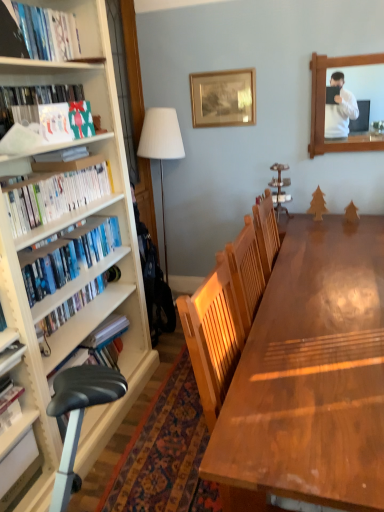
Find the location of a particular element. This screenshot has height=512, width=384. white glossy bookshelf at left, the third book ordered from the bottom is located at coordinates (55, 196).

In order to click on wooden frame at upper right in this screenshot , I will do `click(324, 106)`.

Image resolution: width=384 pixels, height=512 pixels. Describe the element at coordinates (324, 106) in the screenshot. I see `wooden frame at upper right` at that location.

Describe the element at coordinates (21, 475) in the screenshot. I see `hardcover book at left, which is counted as the 1th book, starting from the bottom` at that location.

Locate an element on the screen. hardcover book at left, which is counted as the 1th book, starting from the bottom is located at coordinates (21, 475).

The height and width of the screenshot is (512, 384). Describe the element at coordinates (310, 377) in the screenshot. I see `shiny brown wooden table at center` at that location.

What do you see at coordinates (223, 98) in the screenshot?
I see `wooden picture frame at upper center` at bounding box center [223, 98].

Identify the location of hardcover book at upper left, marked as the first book in a top-to-bottom arrangement. The image size is (384, 512). (48, 33).

How much space does hardcover book at upper left, marked as the first book in a top-to-bottom arrangement, occupy horizontally?

It is 1.96 inches.

The image size is (384, 512). I want to click on matte green gift bag at left, which ranks as the fourth book in bottom-to-top order, so click(x=33, y=102).

Consider the image. Is shiny brown wooden table at center not near hardcover book at left, which is counted as the 1th book, starting from the bottom?

Yes, shiny brown wooden table at center and hardcover book at left, which is counted as the 1th book, starting from the bottom, are quite far apart.

In the image, there is a shiny brown wooden table at center. Where is `book below it (from a real-world perspective)`? book below it (from a real-world perspective) is located at coordinates pyautogui.click(x=21, y=475).

Is shiny brown wooden table at center not within hardcover book at left, which is counted as the 1th book, starting from the bottom?

shiny brown wooden table at center lies outside hardcover book at left, which is counted as the 1th book, starting from the bottom,'s area.

From a real-world perspective, is wooden frame at upper right positioned over shiny brown wooden table at center based on gravity?

Yes, from a real-world perspective, wooden frame at upper right is above shiny brown wooden table at center.

Considering the relative sizes of wooden frame at upper right and shiny brown wooden table at center in the image provided, is wooden frame at upper right shorter than shiny brown wooden table at center?

Indeed, wooden frame at upper right has a lesser height compared to shiny brown wooden table at center.

Which object is positioned more to the left, wooden frame at upper right or shiny brown wooden table at center?

Positioned to the left is shiny brown wooden table at center.

From a real-world perspective, is white glossy bookshelf at left, the third book ordered from the bottom, positioned above or below wooden frame at upper right?

In terms of real-world spatial position, white glossy bookshelf at left, the third book ordered from the bottom, is below wooden frame at upper right.

Visually, is white glossy bookshelf at left, the third book ordered from the bottom, positioned to the left or to the right of wooden frame at upper right?

From the image, it's evident that white glossy bookshelf at left, the third book ordered from the bottom, is to the left of wooden frame at upper right.

Between white glossy bookshelf at left, the 3th book positioned from the top, and wooden frame at upper right, which one has smaller width?

Thinner between the two is wooden frame at upper right.

Find the location of `the 5th book counting from the left side of the wooden picture frame at upper center`. the 5th book counting from the left side of the wooden picture frame at upper center is located at coordinates (21, 475).

From the image's perspective, is wooden picture frame at upper center positioned above or below hardcover book at left, which is counted as the 1th book, starting from the bottom?

wooden picture frame at upper center is above hardcover book at left, which is counted as the 1th book, starting from the bottom.

Are wooden picture frame at upper center and hardcover book at left, which is the fifth book from top to bottom, located far from each other?

Yes, wooden picture frame at upper center is far from hardcover book at left, which is the fifth book from top to bottom.

Is wooden picture frame at upper center facing towards hardcover book at left, which is counted as the 1th book, starting from the bottom?

No, wooden picture frame at upper center does not turn towards hardcover book at left, which is counted as the 1th book, starting from the bottom.

Is white glossy bookshelf at left, the third book ordered from the bottom, wider than shiny brown wooden table at center?

No.

This screenshot has height=512, width=384. In the image, there is a white glossy bookshelf at left, the 3th book positioned from the top. In order to click on desk below it (from the image's perspective) in this screenshot , I will do `click(310, 377)`.

Which is in front, white glossy bookshelf at left, the 3th book positioned from the top, or shiny brown wooden table at center?

shiny brown wooden table at center is more forward.

Which of these two, white glossy bookshelf at left, the 3th book positioned from the top, or shiny brown wooden table at center, stands taller?

With more height is shiny brown wooden table at center.

Does hardcover book at upper left, marked as the first book in a top-to-bottom arrangement, have a greater height compared to wooden frame at upper right?

In fact, hardcover book at upper left, marked as the first book in a top-to-bottom arrangement, may be shorter than wooden frame at upper right.

Based on the photo, can you confirm if hardcover book at upper left, the 5th book positioned from the bottom, is positioned to the right of wooden frame at upper right?

No, hardcover book at upper left, the 5th book positioned from the bottom, is not to the right of wooden frame at upper right.

Is point (73, 57) farther from camera compared to point (324, 150)?

That is False.

Is hardcover book at upper left, marked as the first book in a top-to-bottom arrangement, further to the viewer compared to wooden frame at upper right?

No.

Could wooden frame at upper right be considered to be inside matte green gift bag at left, which ranks as the fourth book in bottom-to-top order?

That's incorrect, wooden frame at upper right is not inside matte green gift bag at left, which ranks as the fourth book in bottom-to-top order.

In terms of width, does matte green gift bag at left, the second book in the top-to-bottom sequence, look wider or thinner when compared to wooden frame at upper right?

Considering their sizes, matte green gift bag at left, the second book in the top-to-bottom sequence, looks broader than wooden frame at upper right.

Identify the location of the 4th book to the left of the wooden frame at upper right, counting from the anchor's position. The image size is (384, 512). (33, 102).

This screenshot has width=384, height=512. I want to click on desk above the hardcover book at left, which is counted as the 1th book, starting from the bottom (from a real-world perspective), so click(310, 377).

Identify the location of desk below the wooden frame at upper right (from a real-world perspective). Image resolution: width=384 pixels, height=512 pixels. (310, 377).

Considering their positions, is matte green gift bag at left, which ranks as the fourth book in bottom-to-top order, positioned further to white glossy bookshelf at left, the third book ordered from the bottom, than shiny brown wooden table at center?

shiny brown wooden table at center lies further to white glossy bookshelf at left, the third book ordered from the bottom, than the other object.

Considering their positions, is wooden frame at upper right positioned further to wooden picture frame at upper center than matte green gift bag at left, which ranks as the fourth book in bottom-to-top order?

Based on the image, matte green gift bag at left, which ranks as the fourth book in bottom-to-top order, appears to be further to wooden picture frame at upper center.

When comparing their distances from hardcover book at upper left, the 5th book positioned from the bottom, does matte green gift bag at left, the second book in the top-to-bottom sequence, or shiny brown wooden table at center seem further?

shiny brown wooden table at center lies further to hardcover book at upper left, the 5th book positioned from the bottom, than the other object.

From the image, which object appears to be farther from blue matte bookshelf at left, arranged as the second book when ordered from the bottom, wooden frame at upper right or hardcover book at left, which is the fifth book from top to bottom?

wooden frame at upper right lies further to blue matte bookshelf at left, arranged as the second book when ordered from the bottom, than the other object.

When comparing their distances from wooden frame at upper right, does matte green gift bag at left, which ranks as the fourth book in bottom-to-top order, or white glossy bookshelf at left, the third book ordered from the bottom, seem closer?

white glossy bookshelf at left, the third book ordered from the bottom, is positioned closer to the anchor wooden frame at upper right.

Looking at the image, which one is located further to wooden frame at upper right, white glossy bookshelf at left, the 3th book positioned from the top, or blue matte bookshelf at left, arranged as the second book when ordered from the bottom?

blue matte bookshelf at left, arranged as the second book when ordered from the bottom, is further to wooden frame at upper right.

Estimate the real-world distances between objects in this image. Which object is closer to white fabric lampshade at left, blue matte bookshelf at left, arranged as the second book when ordered from the bottom, or hardcover book at left, which is counted as the 1th book, starting from the bottom?

blue matte bookshelf at left, arranged as the second book when ordered from the bottom, is closer to white fabric lampshade at left.

Considering their positions, is white fabric lampshade at left positioned closer to hardcover book at upper left, the 5th book positioned from the bottom, than hardcover book at left, which is the fifth book from top to bottom?

white fabric lampshade at left.

The height and width of the screenshot is (512, 384). What are the coordinates of `mirror positioned between shiny brown wooden table at center and wooden picture frame at upper center from near to far` in the screenshot? It's located at (324, 106).

At what (x,y) coordinates should I click in order to perform the action: click on mirror between shiny brown wooden table at center and white fabric lampshade at left along the z-axis. Please return your answer as a coordinate pair (x, y). Looking at the image, I should click on (324, 106).

Find the location of `lamp positioned between shiny brown wooden table at center and wooden picture frame at upper center from near to far`. lamp positioned between shiny brown wooden table at center and wooden picture frame at upper center from near to far is located at coordinates (161, 145).

Where is `lamp located between matte green gift bag at left, the second book in the top-to-bottom sequence, and wooden frame at upper right in the left-right direction`? lamp located between matte green gift bag at left, the second book in the top-to-bottom sequence, and wooden frame at upper right in the left-right direction is located at coordinates (161, 145).